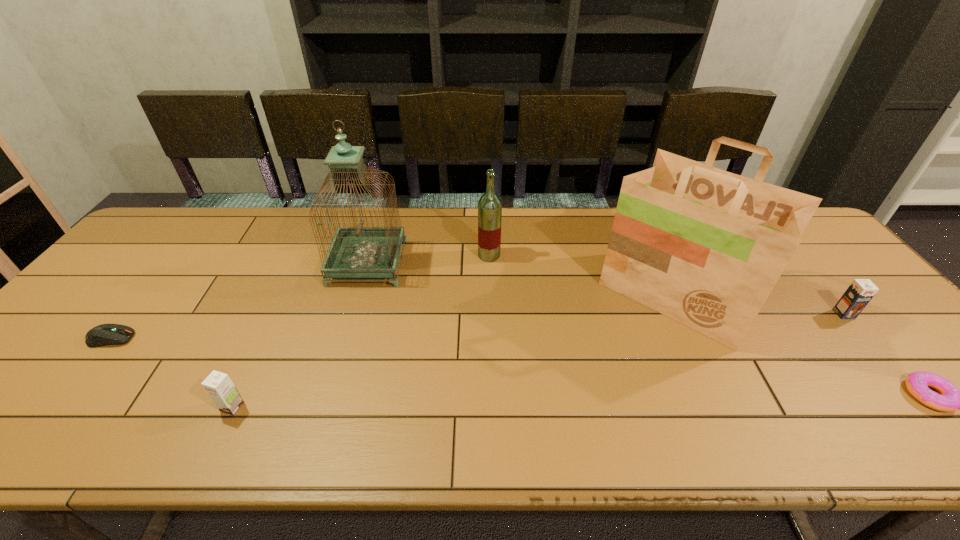
Find the location of `free region located 0.270m on the right of the liquor`. free region located 0.270m on the right of the liquor is located at coordinates (589, 255).

Locate an element on the screen. This screenshot has height=540, width=960. vacant region located on the front label of the farther chocolate milk is located at coordinates (900, 381).

Find the location of `blank space located 0.330m on the left of the nearer chocolate milk`. blank space located 0.330m on the left of the nearer chocolate milk is located at coordinates (69, 407).

This screenshot has width=960, height=540. Identify the location of blank space located on the button of the leftmost object. (246, 339).

Identify the location of birdcage present at the far edge. (355, 252).

I want to click on grocery bag positioned at the far edge, so click(705, 247).

The image size is (960, 540). In order to click on liquor present at the far edge in this screenshot , I will do `click(490, 205)`.

Locate an element on the screen. The width and height of the screenshot is (960, 540). object at the near edge is located at coordinates (218, 385).

Find the location of `object that is positioned at the left edge`. object that is positioned at the left edge is located at coordinates (105, 334).

Locate an element on the screen. Image resolution: width=960 pixels, height=540 pixels. object that is at the right edge is located at coordinates (860, 292).